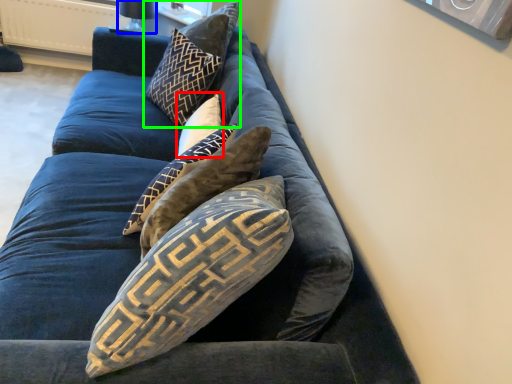
Question: Which is nearer to the pillow (highlighted by a red box)? lamp (highlighted by a blue box) or pillow (highlighted by a green box).

Choices:
 (A) lamp
 (B) pillow

Answer: (B)